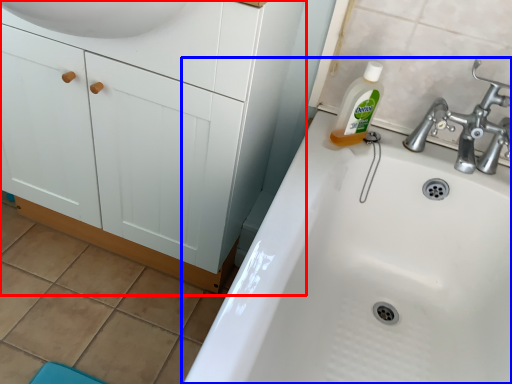
Question: Which object appears farthest to the camera in this image, bathroom cabinet (highlighted by a red box) or sink (highlighted by a blue box)?

Choices:
 (A) bathroom cabinet
 (B) sink

Answer: (A)